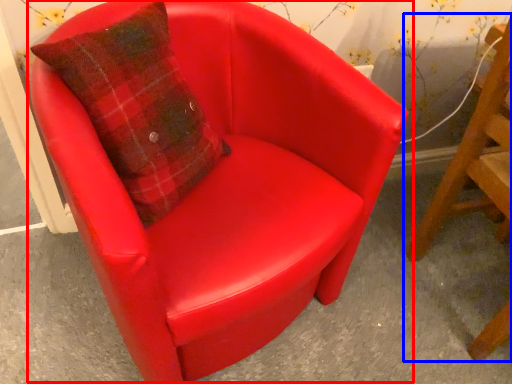
Question: Which object appears farthest to the camera in this image, chair (highlighted by a red box) or chair (highlighted by a blue box)?

Choices:
 (A) chair
 (B) chair

Answer: (B)